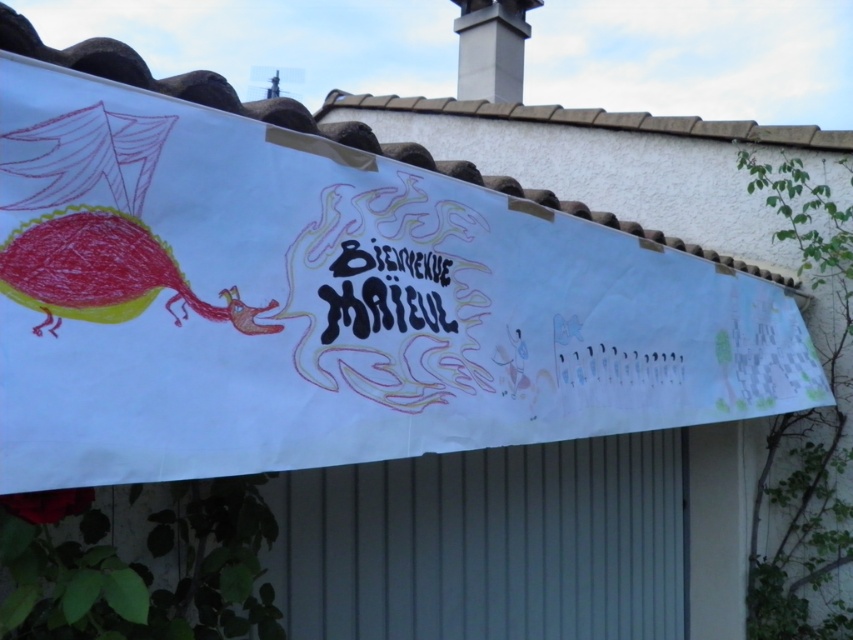
You are standing at the entrance of the building and want to read the text on the white paper banner at center. Is the white smooth chimney at upper center blocking your view of the banner?

The white paper banner at center is closer to the viewer than the white smooth chimney at upper center, so the chimney is not blocking the view of the banner.